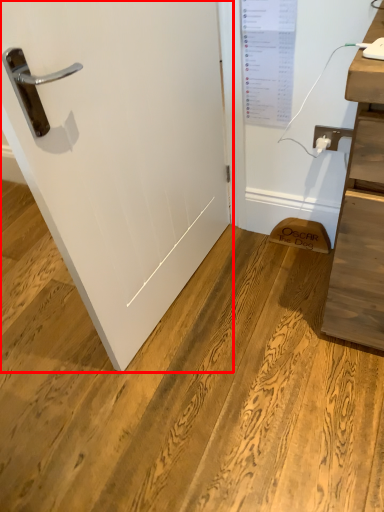
Question: From the image's perspective, considering the relative positions of door (annotated by the red box) and electric outlet in the image provided, where is door (annotated by the red box) located with respect to the staircase?

Choices:
 (A) above
 (B) below

Answer: (B)